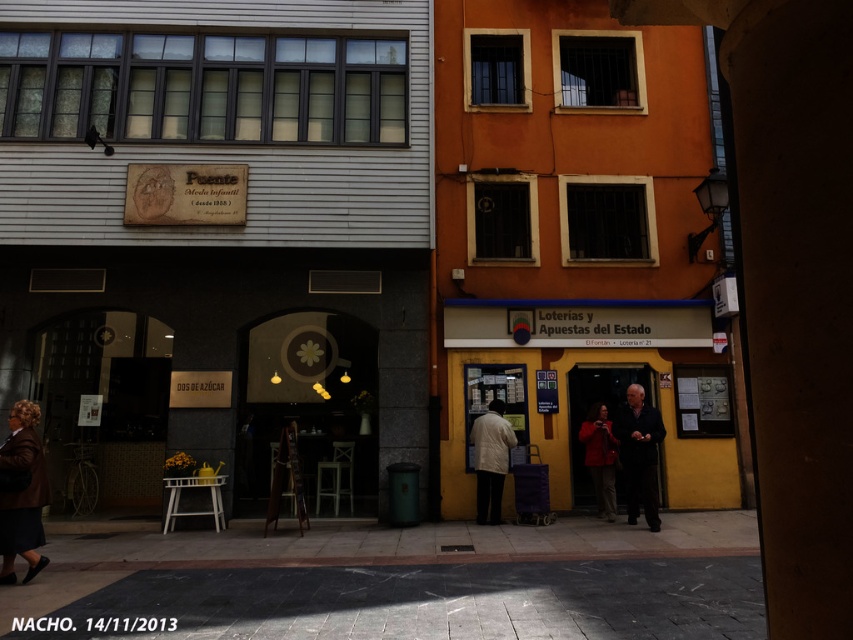
Question: Estimate the real-world distances between objects in this image. Which object is farther from the yellow matte building at center?

Choices:
 (A) dark brown leather coat at lower left
 (B) matte red coat at center
 (C) dark wool coat at center

Answer: (A)

Question: From the image, what is the correct spatial relationship of dark brown leather coat at lower left in relation to matte red coat at center?

Choices:
 (A) right
 (B) left

Answer: (B)

Question: Which point appears farthest from the camera in this image?

Choices:
 (A) (656, 433)
 (B) (489, 342)
 (C) (480, 486)

Answer: (B)

Question: Which point is closer to the camera?

Choices:
 (A) (641, 433)
 (B) (492, 445)

Answer: (A)

Question: Is yellow matte building at center to the left of dark wool coat at center from the viewer's perspective?

Choices:
 (A) yes
 (B) no

Answer: (A)

Question: Is yellow matte building at center to the right of dark wool coat at center from the viewer's perspective?

Choices:
 (A) no
 (B) yes

Answer: (A)